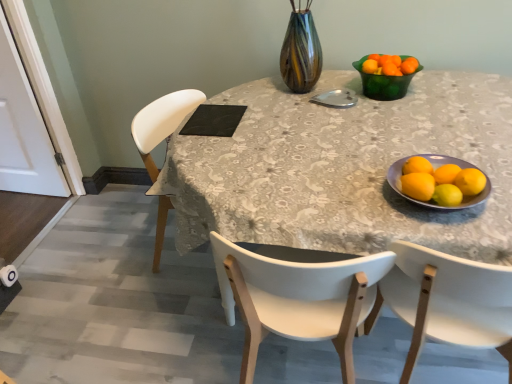
Where is `free space above matte ceramic bowl at right (from a real-world perspective)`? free space above matte ceramic bowl at right (from a real-world perspective) is located at coordinates (435, 177).